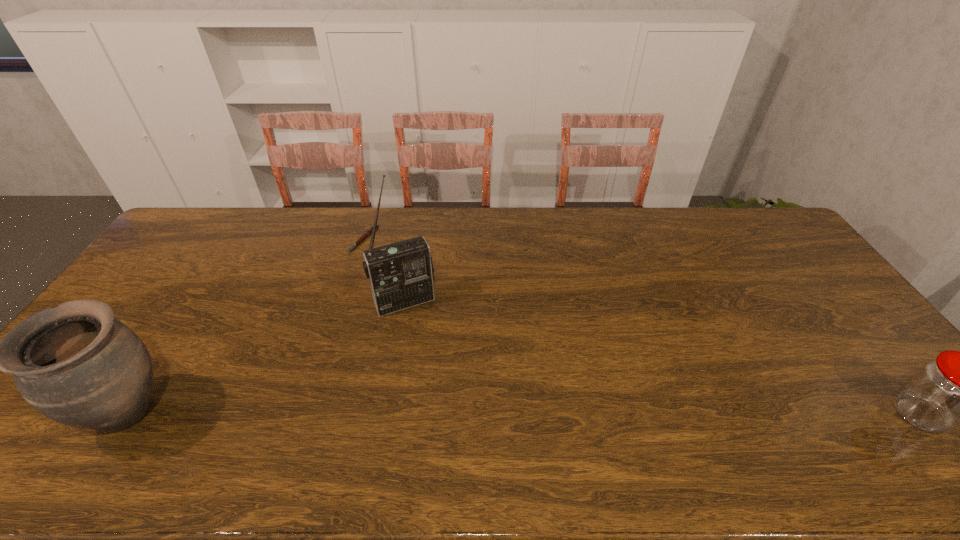
In order to click on the leftmost object in this screenshot , I will do `click(76, 364)`.

Image resolution: width=960 pixels, height=540 pixels. I want to click on urn, so click(76, 364).

Identify the location of the shortest object. The image size is (960, 540). (368, 232).

You are a GUI agent. You are given a task and a screenshot of the screen. Output one action in this format:
    pyautogui.click(x=<x>, y=<y>)
    Task: Click on the third object from right to left
    
    Given the screenshot: What is the action you would take?
    pyautogui.click(x=368, y=232)

You are a GUI agent. You are given a task and a screenshot of the screen. Output one action in this format:
    pyautogui.click(x=<x>, y=<y>)
    Task: Click on the third nearest object
    This screenshot has height=540, width=960.
    Given the screenshot: What is the action you would take?
    pyautogui.click(x=400, y=274)

Image resolution: width=960 pixels, height=540 pixels. I want to click on the tallest object, so click(400, 274).

You are a GUI agent. You are given a task and a screenshot of the screen. Output one action in this format:
    pyautogui.click(x=<x>, y=<y>)
    Task: Click on the vacant space located on the back of the third shortest object
    This screenshot has width=960, height=540.
    Given the screenshot: What is the action you would take?
    pyautogui.click(x=220, y=273)

At what (x,y) coordinates should I click in order to perform the action: click on vacant space situated 0.160m at the nib of the farthest object. Please return your answer as a coordinate pair (x, y). Looking at the image, I should click on (385, 279).

Image resolution: width=960 pixels, height=540 pixels. What are the coordinates of `free space located at the nib of the farthest object` in the screenshot? It's located at (394, 292).

Find the location of a particular element. Image resolution: width=960 pixels, height=540 pixels. free space located at the nib of the farthest object is located at coordinates (416, 325).